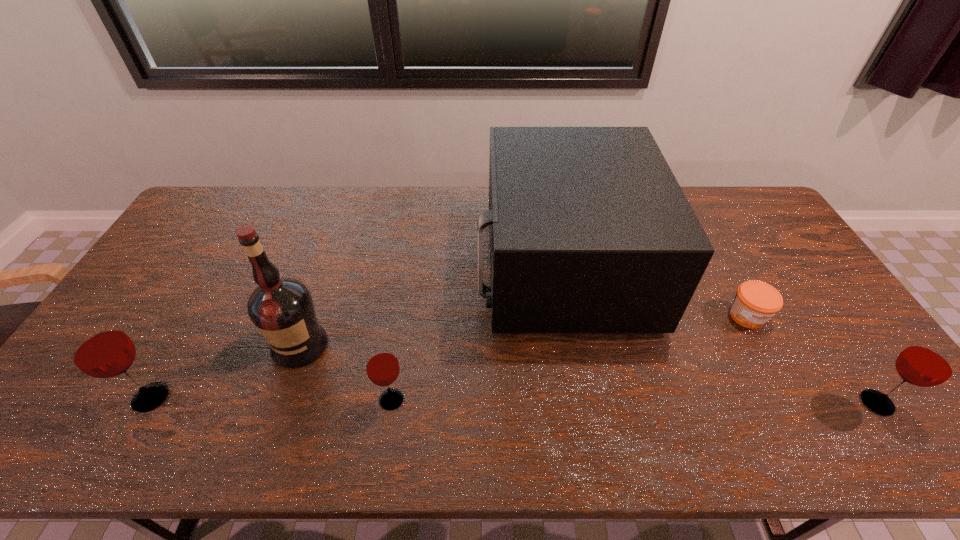
You are a GUI agent. You are given a task and a screenshot of the screen. Output one action in this format:
    pyautogui.click(x=<x>, y=<y>)
    Task: Click on the fifth object from left to right
    
    Given the screenshot: What is the action you would take?
    pyautogui.click(x=755, y=302)

I want to click on free space located on the right of the leftmost glass, so click(304, 398).

Where is `vacant space situated on the left of the shortest glass`? vacant space situated on the left of the shortest glass is located at coordinates (344, 400).

Find the location of `vacant area situated on the left of the rightmost glass`. vacant area situated on the left of the rightmost glass is located at coordinates (742, 403).

Identify the location of free region located on the front-facing side of the fourth object from left to right. (379, 265).

This screenshot has height=540, width=960. In order to click on free region located on the front-facing side of the fourth object from left to right in this screenshot , I will do `click(440, 265)`.

Image resolution: width=960 pixels, height=540 pixels. Identify the location of free location located on the front-facing side of the fourth object from left to right. (456, 265).

This screenshot has height=540, width=960. Find the location of `blank area located on the front label of the second object from right to left`. blank area located on the front label of the second object from right to left is located at coordinates (796, 407).

Image resolution: width=960 pixels, height=540 pixels. I want to click on object situated at the far edge, so click(x=590, y=232).

Identify the location of object present at the right edge. (931, 361).